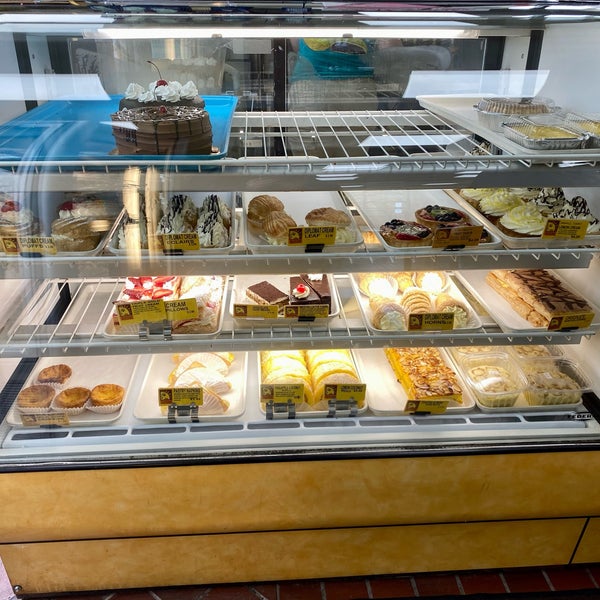
Image resolution: width=600 pixels, height=600 pixels. Find the location of `aluminum tray`. aluminum tray is located at coordinates (497, 125), (575, 142), (547, 120), (593, 140).